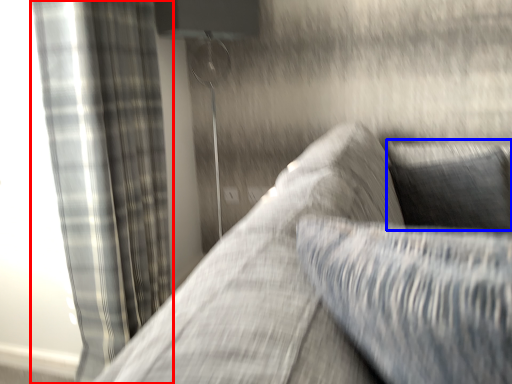
Question: Which of the following is the closest to the observer, curtain (highlighted by a red box) or pillow (highlighted by a blue box)?

Choices:
 (A) curtain
 (B) pillow

Answer: (A)